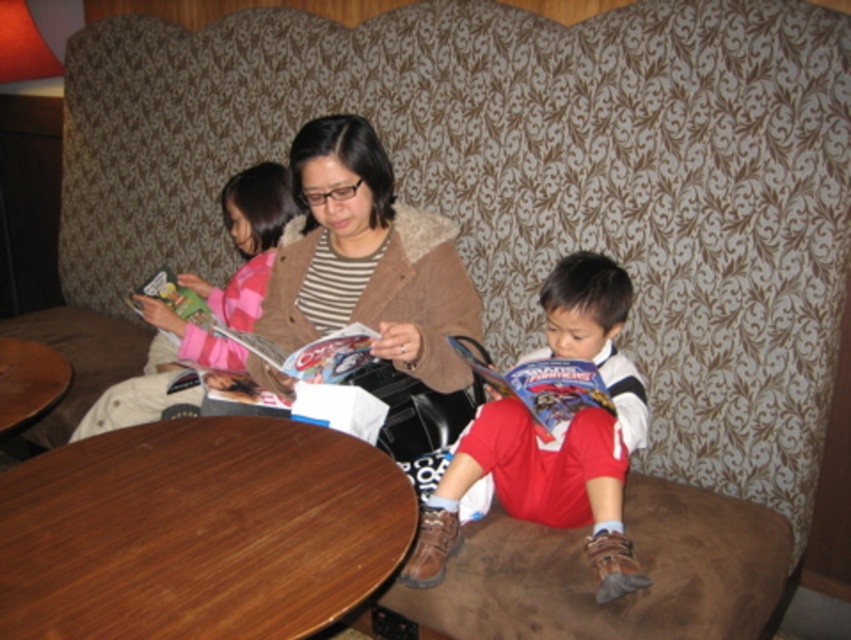
Question: Among these objects, which one is nearest to the camera?

Choices:
 (A) matte plastic magazine at lower right
 (B) pink striped sweater at upper left

Answer: (A)

Question: Considering the relative positions of red cotton shirt at center and matte plastic magazine at lower right in the image provided, where is red cotton shirt at center located with respect to matte plastic magazine at lower right?

Choices:
 (A) above
 (B) below

Answer: (B)

Question: Which object is positioned farthest from the red cotton shirt at center?

Choices:
 (A) brown wood table at lower left
 (B) matte plastic magazine at center

Answer: (A)

Question: Which is nearer to the red cotton shirt at center?

Choices:
 (A) brown fuzzy jacket at center
 (B) pink striped sweater at upper left
 (C) matte plastic magazine at lower right
 (D) matte plastic magazine at center

Answer: (C)

Question: Does matte plastic magazine at lower right have a greater width compared to matte plastic magazine at center?

Choices:
 (A) no
 (B) yes

Answer: (A)

Question: Can you confirm if red cotton shirt at center is thinner than matte plastic magazine at lower right?

Choices:
 (A) no
 (B) yes

Answer: (A)